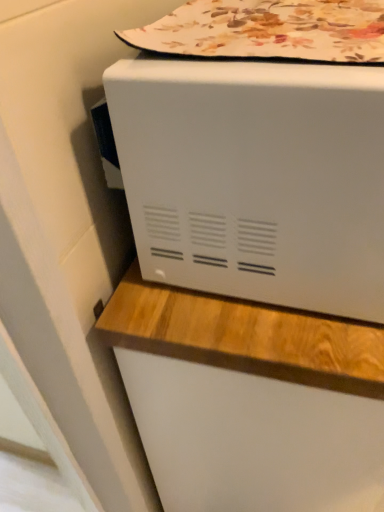
Find the location of a particular element. This screenshot has width=384, height=512. free point above white matte microwave at upper center (from a real-world perspective) is located at coordinates (291, 21).